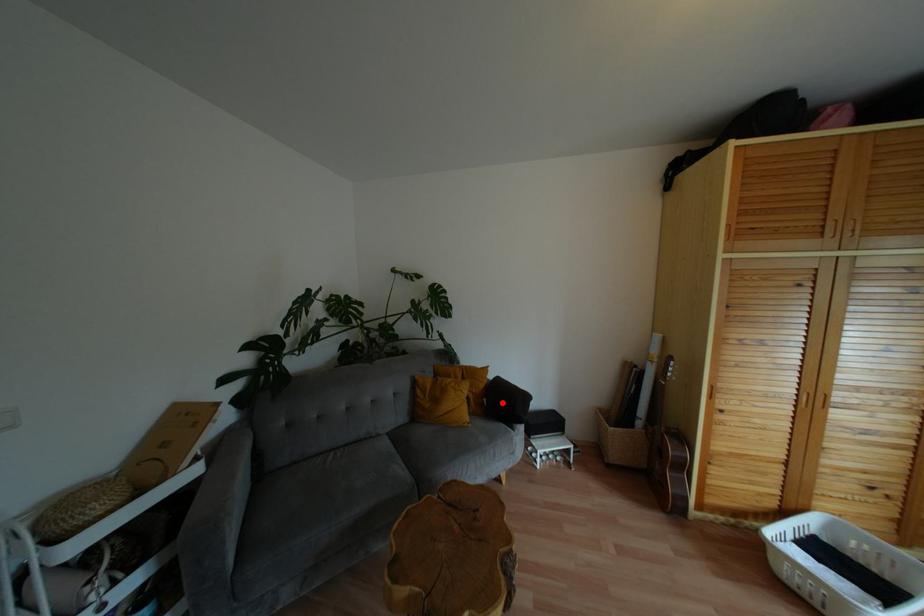
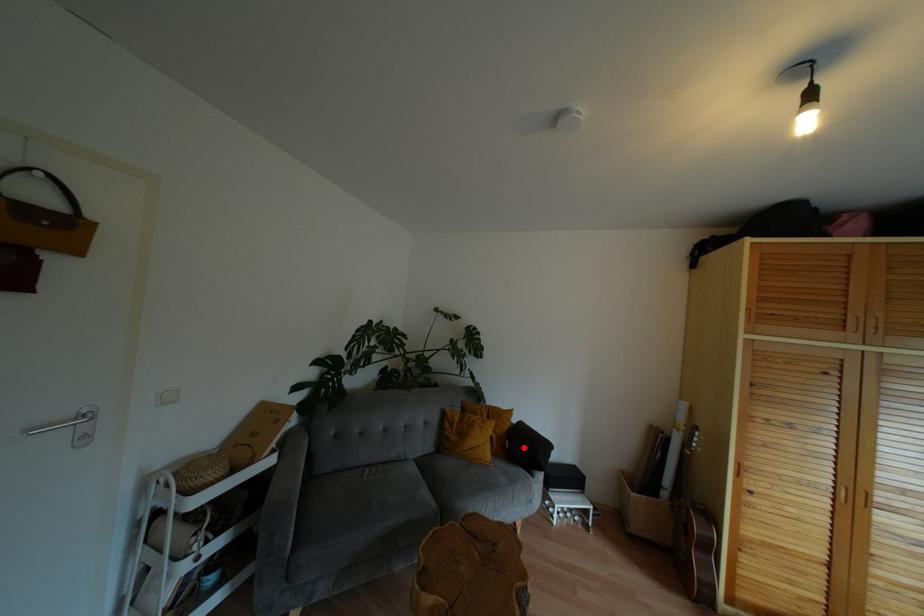
I am providing you with two images of the same scene from different viewpoints. A red point is marked on the first image and another point is marked on the second image. Is the marked point in image1 the same physical position as the marked point in image2?

Yes